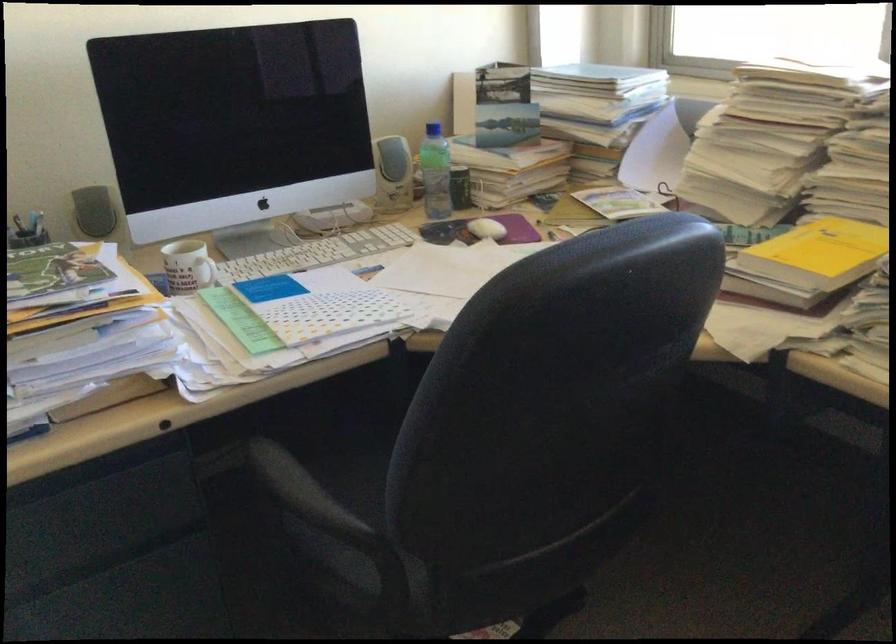
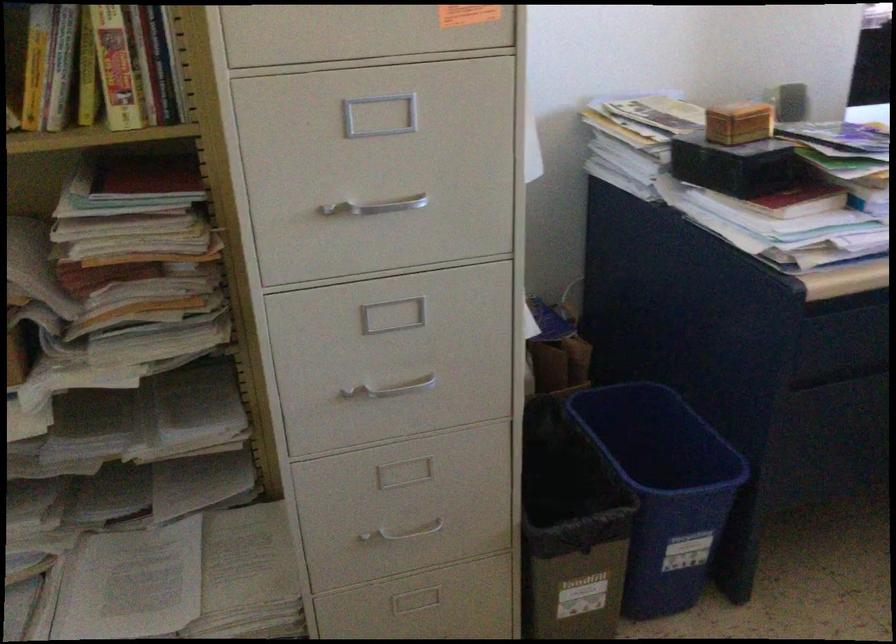
What movement of the cameraman would produce the second image?

The movement direction of the cameraman is left, backward.